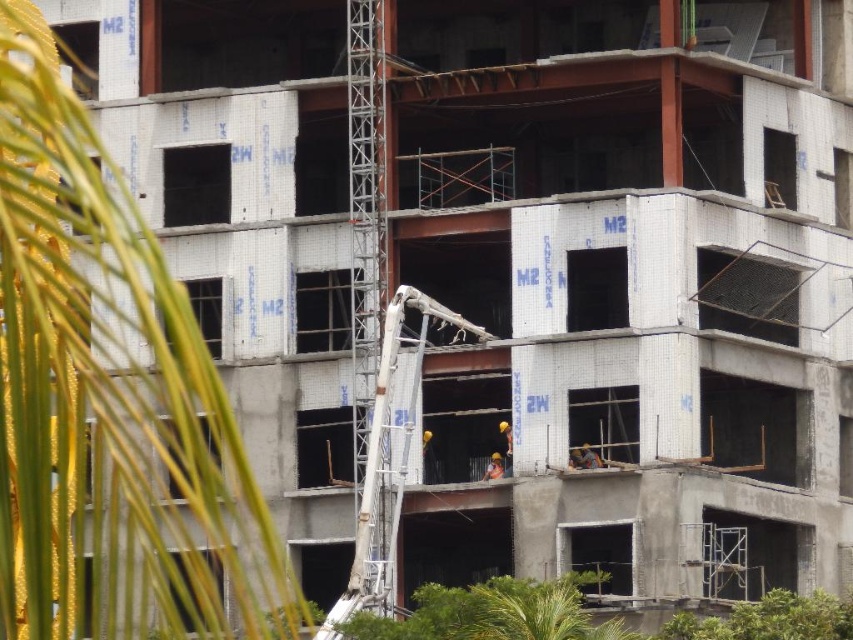
Question: Based on their relative distances, which object is farther from the orange hard hat at center?

Choices:
 (A) green leafy palm tree at lower right
 (B) white concrete ladder at center

Answer: (A)

Question: Which object appears farthest from the camera in this image?

Choices:
 (A) hard hat construction worker at center
 (B) orange hard hat at center
 (C) green leafy palm tree at left

Answer: (A)

Question: Among these points, which one is farthest from the camera?

Choices:
 (A) (22, 513)
 (B) (587, 454)

Answer: (B)

Question: Does green leafy palm tree at lower right appear on the right side of orange hard hat at center?

Choices:
 (A) no
 (B) yes

Answer: (A)

Question: Can you confirm if white concrete ladder at center is positioned below hard hat construction worker at center?

Choices:
 (A) yes
 (B) no

Answer: (B)

Question: In this image, where is white concrete ladder at center located relative to hard hat construction worker at center?

Choices:
 (A) left
 (B) right

Answer: (A)